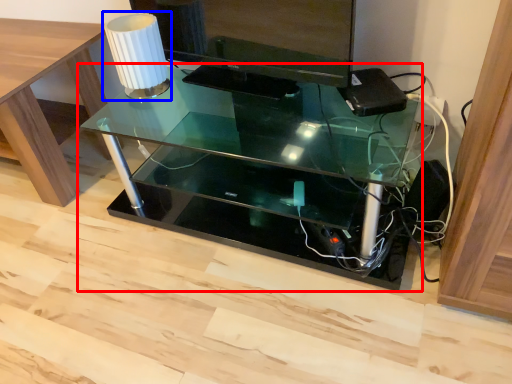
Question: Which point is closer to the camera, table (highlighted by a red box) or table lamp (highlighted by a blue box)?

Choices:
 (A) table
 (B) table lamp

Answer: (A)